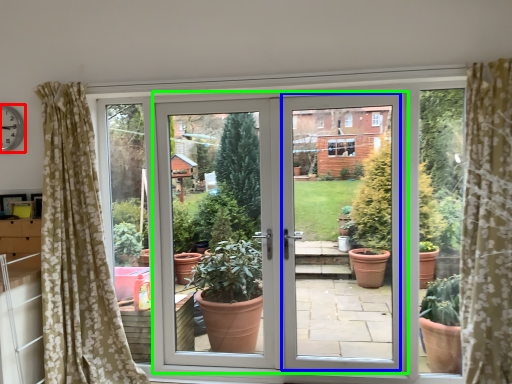
Question: Considering the real-world distances, which object is farthest from clock (highlighted by a red box)? screen door (highlighted by a blue box) or door (highlighted by a green box)?

Choices:
 (A) screen door
 (B) door

Answer: (A)